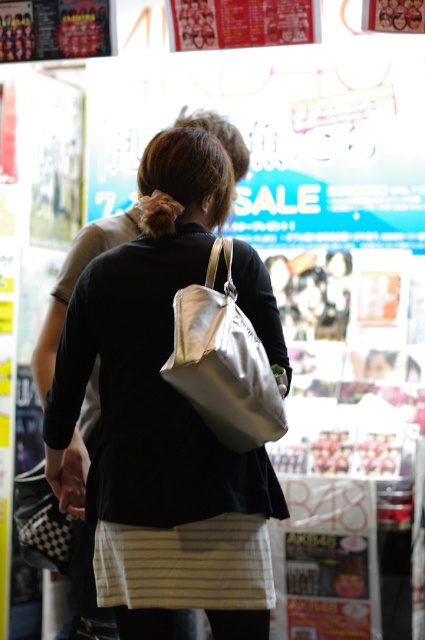
Find the location of a particular element. The image size is (425, 640). white fabric bag at center is located at coordinates (163, 419).

Is white fabric bag at center taller than white striped apron at lower center?

Yes, white fabric bag at center is taller than white striped apron at lower center.

Is point (135, 376) behind point (266, 588)?

Yes, point (135, 376) is behind point (266, 588).

Find the location of a particular element. white fabric bag at center is located at coordinates (163, 419).

Which is more to the left, white fabric bag at center or white fabric shoulder bag at center?

white fabric bag at center is more to the left.

Is white fabric bag at center positioned behind white fabric shoulder bag at center?

Yes, white fabric bag at center is further from the viewer.

Between point (93, 269) and point (204, 307), which one is positioned in front?

Point (204, 307)

Locate an element on the screen. white fabric bag at center is located at coordinates (163, 419).

Can you confirm if white striped apron at lower center is thinner than white fabric shoulder bag at center?

No.

In the scene shown: Who is taller, white striped apron at lower center or white fabric shoulder bag at center?

white fabric shoulder bag at center

I want to click on white striped apron at lower center, so click(x=186, y=564).